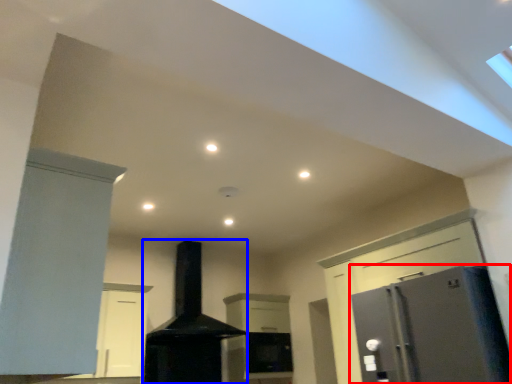
Question: Which object appears closest to the camera in this image, refrigerator (highlighted by a red box) or fireplace (highlighted by a blue box)?

Choices:
 (A) refrigerator
 (B) fireplace

Answer: (A)